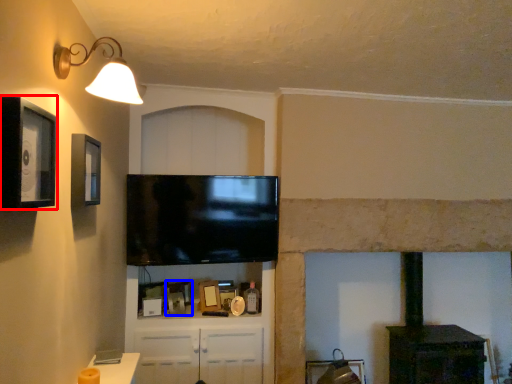
Question: Which point is further to the camera, picture frame (highlighted by a red box) or picture frame (highlighted by a blue box)?

Choices:
 (A) picture frame
 (B) picture frame

Answer: (B)